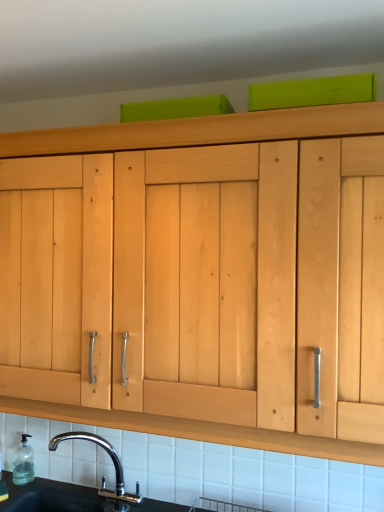
Measure the distance between point (18, 475) and camera.

Point (18, 475) is 5.06 feet away from camera.

The height and width of the screenshot is (512, 384). I want to click on transparent plastic bottle at lower left, so click(x=23, y=462).

The image size is (384, 512). What do you see at coordinates (23, 462) in the screenshot?
I see `transparent plastic bottle at lower left` at bounding box center [23, 462].

In order to click on transparent plastic bottle at lower left in this screenshot , I will do `click(23, 462)`.